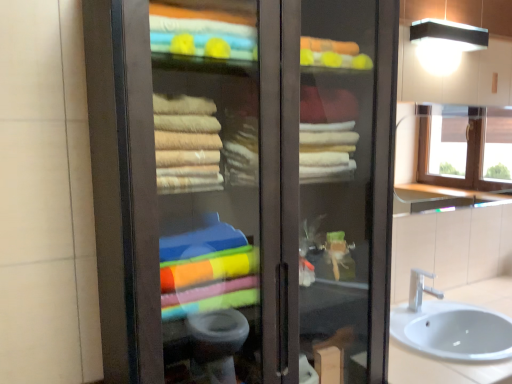
Question: From a real-world perspective, is matte glass cabinet at center physically located above or below silver metallic faucet at lower right?

Choices:
 (A) above
 (B) below

Answer: (A)

Question: Visually, is matte glass cabinet at center positioned to the left or to the right of silver metallic faucet at lower right?

Choices:
 (A) right
 (B) left

Answer: (B)

Question: Considering the real-world distances, which object is farthest from the clear glass window at upper right?

Choices:
 (A) white ceramic sink at lower right
 (B) black matte light fixture at upper right
 (C) matte glass cabinet at center
 (D) silver metallic faucet at lower right

Answer: (C)

Question: Which of these objects is positioned farthest from the matte glass cabinet at center?

Choices:
 (A) white ceramic sink at lower right
 (B) black matte light fixture at upper right
 (C) clear glass window at upper right
 (D) silver metallic faucet at lower right

Answer: (C)